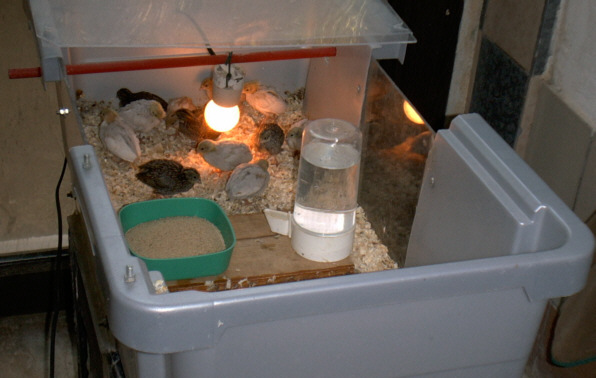
Identify the location of bedding. (374, 256).